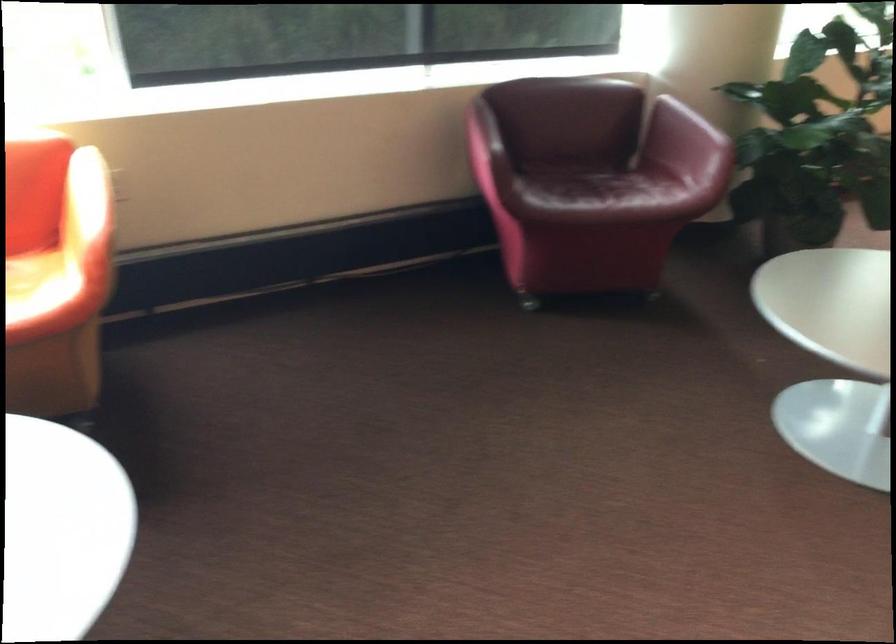
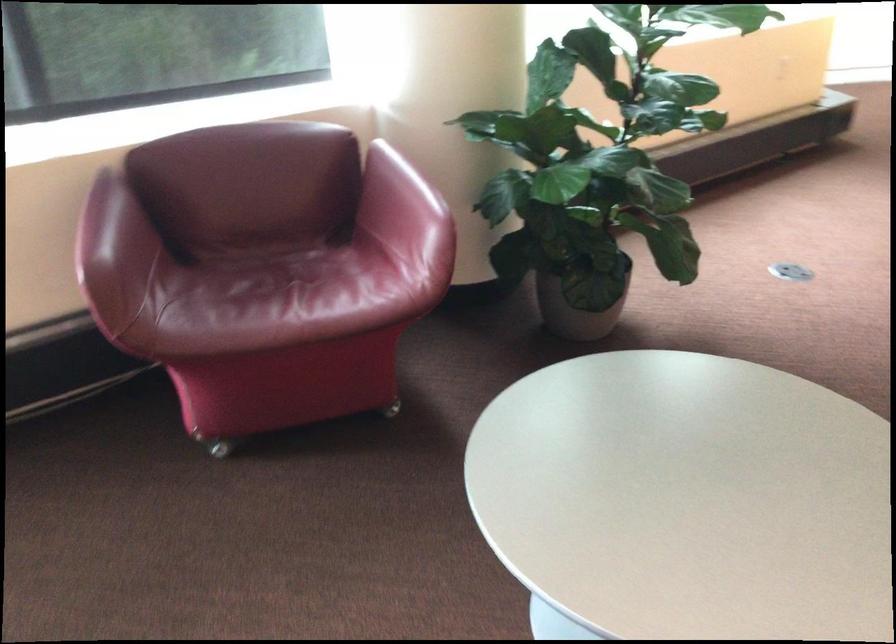
The images are taken continuously from a first-person perspective. In which direction are you moving?

The cameraman moved toward right, forward.